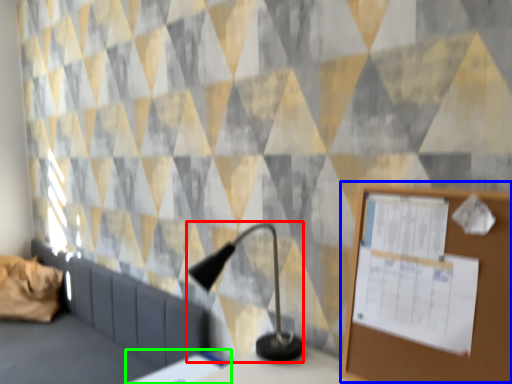
Question: Estimate the real-world distances between objects in this image. Which object is farther from table lamp (highlighted by a red box), bulletin board (highlighted by a blue box) or table (highlighted by a green box)?

Choices:
 (A) bulletin board
 (B) table

Answer: (A)